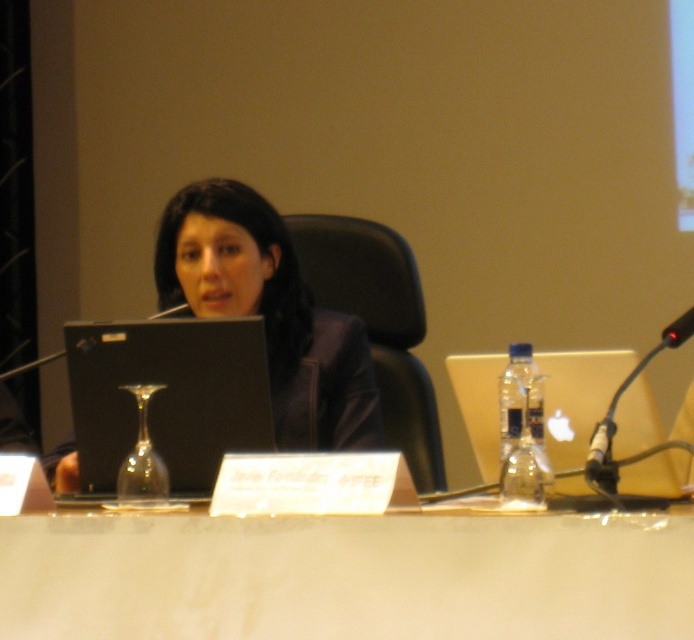
You are a photographer trying to capture a closeup of the matte black laptop at center. Based on its position in the scene, where should you aim your camera relative to the person seated at the conference table?

The matte black laptop at center is located at coordinates point [269,312], so you should aim your camera slightly to the right and lower than the person seated at the conference table to capture the closeup.